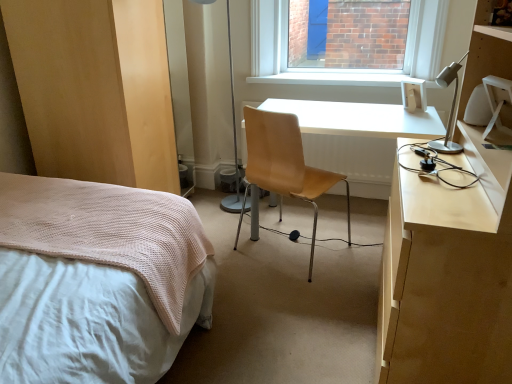
Question: Is light brown leather chair at center turned away from white glossy desk at center?

Choices:
 (A) no
 (B) yes

Answer: (B)

Question: From a real-world perspective, does light brown leather chair at center stand above white glossy desk at center?

Choices:
 (A) no
 (B) yes

Answer: (B)

Question: From the image's perspective, is light brown leather chair at center beneath white glossy desk at center?

Choices:
 (A) no
 (B) yes

Answer: (B)

Question: Does light brown leather chair at center come behind white glossy desk at center?

Choices:
 (A) no
 (B) yes

Answer: (A)

Question: Is the position of light brown leather chair at center less distant than that of white glossy desk at center?

Choices:
 (A) no
 (B) yes

Answer: (B)

Question: Is light brown leather chair at center next to white glossy desk at center?

Choices:
 (A) yes
 (B) no

Answer: (B)

Question: From the image's perspective, is metallic silver table lamp at center located above white glossy desk at center?

Choices:
 (A) no
 (B) yes

Answer: (B)

Question: Is metallic silver table lamp at center outside white glossy desk at center?

Choices:
 (A) no
 (B) yes

Answer: (B)

Question: Is metallic silver table lamp at center further to the viewer compared to white glossy desk at center?

Choices:
 (A) yes
 (B) no

Answer: (A)

Question: Does metallic silver table lamp at center have a lesser width compared to white glossy desk at center?

Choices:
 (A) no
 (B) yes

Answer: (B)

Question: Does metallic silver table lamp at center have a lesser height compared to white glossy desk at center?

Choices:
 (A) yes
 (B) no

Answer: (B)

Question: Is metallic silver table lamp at center looking in the opposite direction of white glossy desk at center?

Choices:
 (A) yes
 (B) no

Answer: (B)

Question: Does white smooth window sill at upper center contain light brown wood dresser at lower left?

Choices:
 (A) yes
 (B) no

Answer: (B)